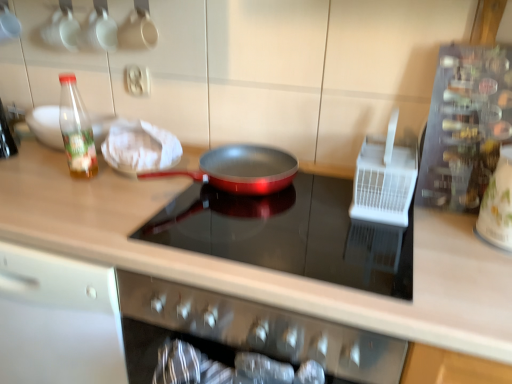
Locate an element on the screen. This screenshot has height=384, width=512. vacant space that is in between metallic silver spice rack at right, placed as the second appliance when sorted from left to right, and white glossy jar at right, arranged as the first appliance when viewed from the right is located at coordinates (454, 226).